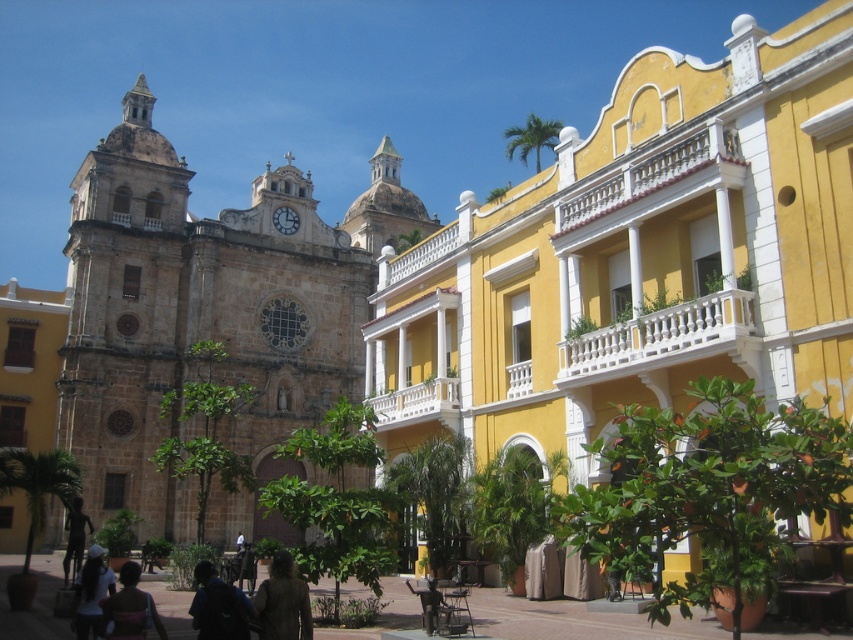
Question: Which object appears farthest from the camera in this image?

Choices:
 (A) dark brown leather jacket at lower center
 (B) brown stone church at left

Answer: (B)

Question: Does bronze statue at lower left have a lesser width compared to white fabric shirt at center?

Choices:
 (A) yes
 (B) no

Answer: (B)

Question: Which object is positioned closest to the white fabric shirt at center?

Choices:
 (A) white cotton shirt at lower left
 (B) bronze statue at lower left
 (C) brown stone church at left

Answer: (B)

Question: Does brown textured coat at lower center have a larger size compared to dark brown leather jacket at lower center?

Choices:
 (A) yes
 (B) no

Answer: (A)

Question: Can you confirm if dark blue backpack at lower center is thinner than white cotton shirt at lower left?

Choices:
 (A) no
 (B) yes

Answer: (A)

Question: Which object appears farthest from the camera in this image?

Choices:
 (A) white fabric shirt at center
 (B) dark blue backpack at lower center
 (C) matte stone church at center

Answer: (A)